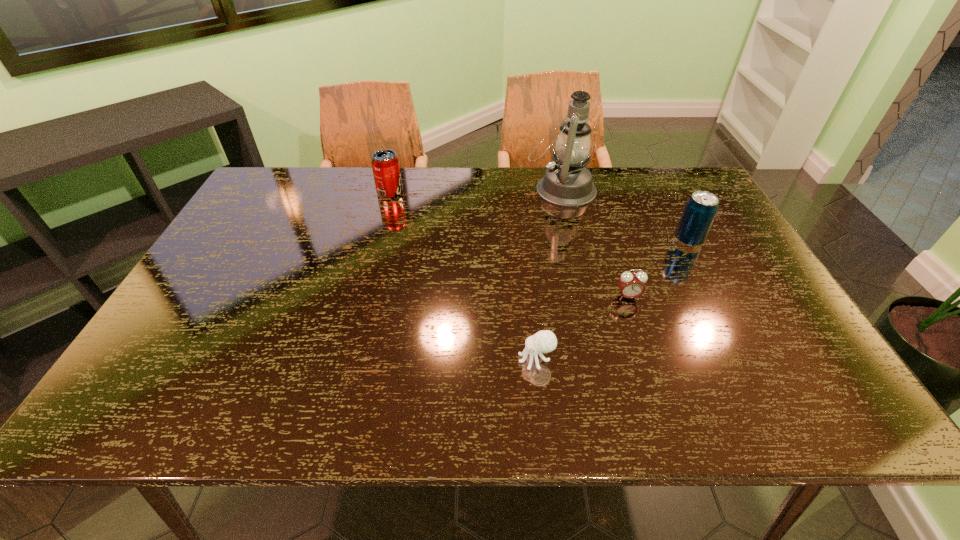
Locate an element on the screen. oil lamp is located at coordinates (567, 183).

Identify the location of the right soda can. (701, 208).

The image size is (960, 540). In order to click on the third nearest object in this screenshot , I will do `click(701, 208)`.

Image resolution: width=960 pixels, height=540 pixels. Identify the location of the left soda can. (385, 164).

In order to click on the farther soda can in this screenshot , I will do `click(385, 164)`.

Locate an element on the screen. The width and height of the screenshot is (960, 540). alarm clock is located at coordinates (631, 285).

Locate an element on the screen. This screenshot has height=540, width=960. octopus is located at coordinates [x=544, y=341].

Identify the location of free space located 0.100m on the right of the tallest object. This screenshot has height=540, width=960. (x=627, y=190).

You are a GUI agent. You are given a task and a screenshot of the screen. Output one action in this format:
    pyautogui.click(x=<x>, y=<y>)
    Task: Click on the free spot located 0.240m on the back of the right soda can
    
    Given the screenshot: What is the action you would take?
    pyautogui.click(x=660, y=186)

The height and width of the screenshot is (540, 960). What are the coordinates of `blank area located 0.400m on the right of the leftmost object` in the screenshot? It's located at (x=526, y=192).